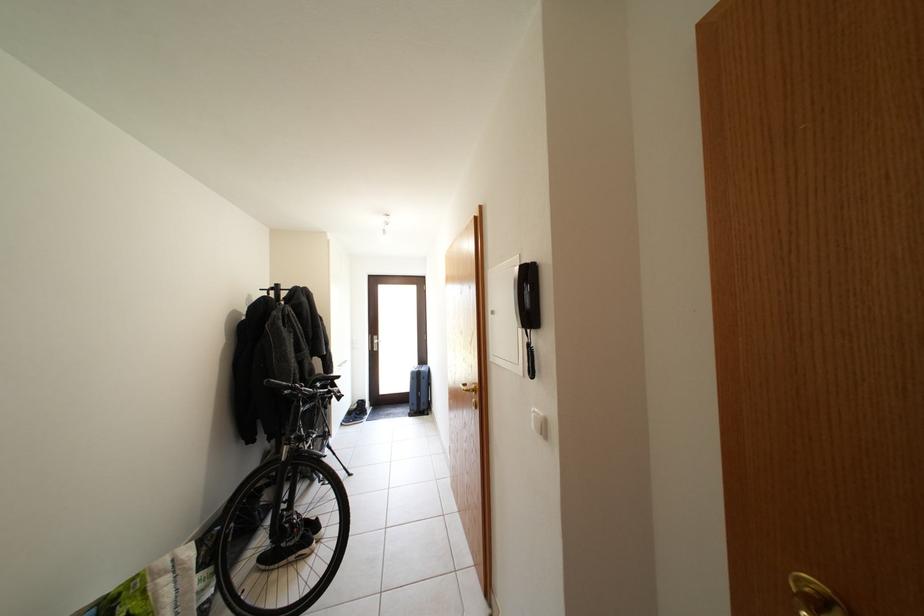
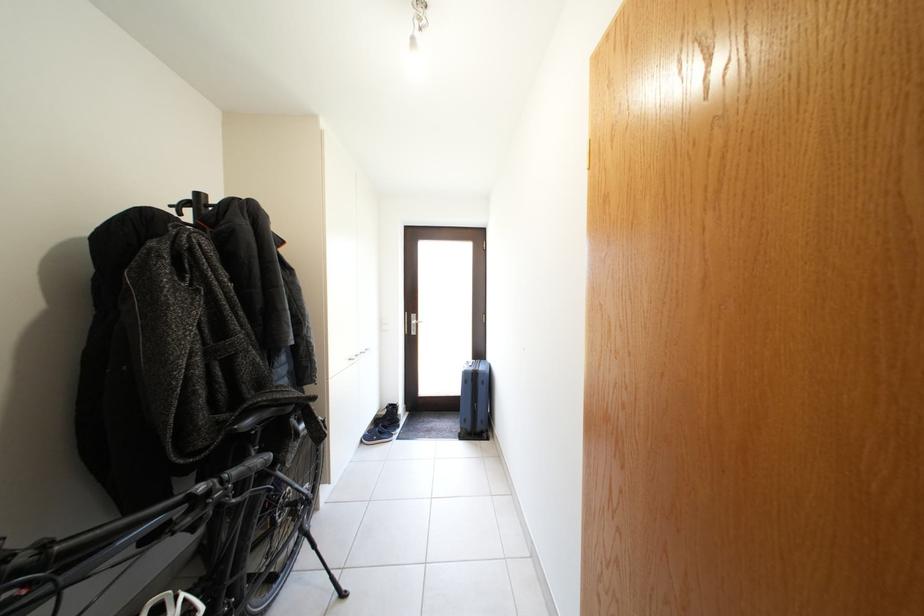
Find the pixel in the second image that matches [365,419] in the first image.

(392, 431)